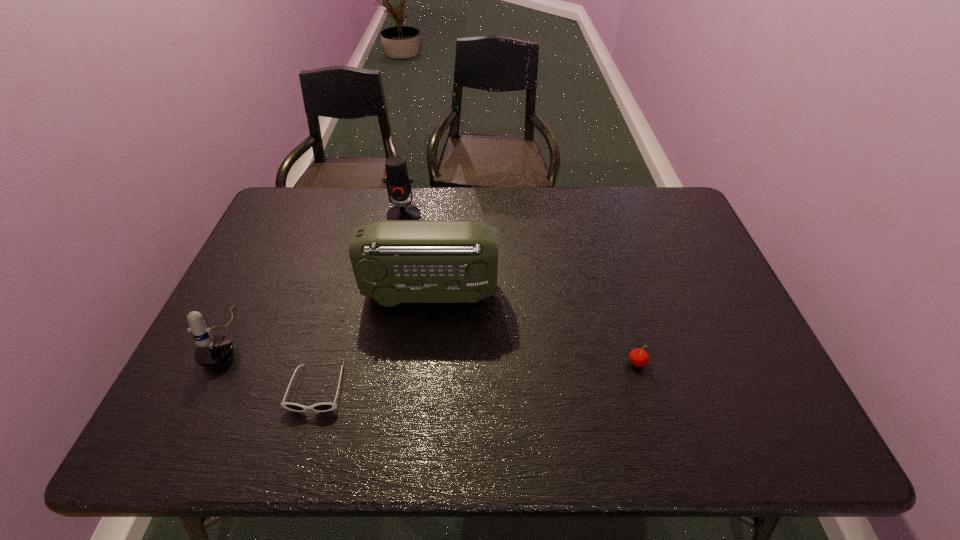
Find the location of `vacant region located 0.400m on the back of the shorter microphone`. vacant region located 0.400m on the back of the shorter microphone is located at coordinates (289, 214).

This screenshot has height=540, width=960. What are the coordinates of `free space located on the front of the cherry` in the screenshot? It's located at (655, 422).

Identify the location of free spot located 0.070m with the lenses of the sunglasses facing outward. (301, 446).

Identify the location of object that is positioned at the far edge. The width and height of the screenshot is (960, 540). (398, 184).

I want to click on object that is at the near edge, so click(x=327, y=406).

You are a GUI agent. You are given a task and a screenshot of the screen. Output one action in this format:
    pyautogui.click(x=<x>, y=<y>)
    Task: Click on the object located at the left edge
    This screenshot has width=960, height=540.
    Given the screenshot: What is the action you would take?
    pyautogui.click(x=212, y=350)

In the image, there is a desktop. Identify the location of vacant space at the far edge. (496, 198).

At what (x,y) coordinates should I click in order to perform the action: click on vacant space at the near edge of the desktop. Please return your answer as a coordinate pair (x, y). The width and height of the screenshot is (960, 540). Looking at the image, I should click on pos(318,414).

Where is `vacant space at the left edge of the desktop`? This screenshot has height=540, width=960. vacant space at the left edge of the desktop is located at coordinates (273, 292).

The image size is (960, 540). In order to click on blank space at the right edge in this screenshot , I will do click(719, 279).